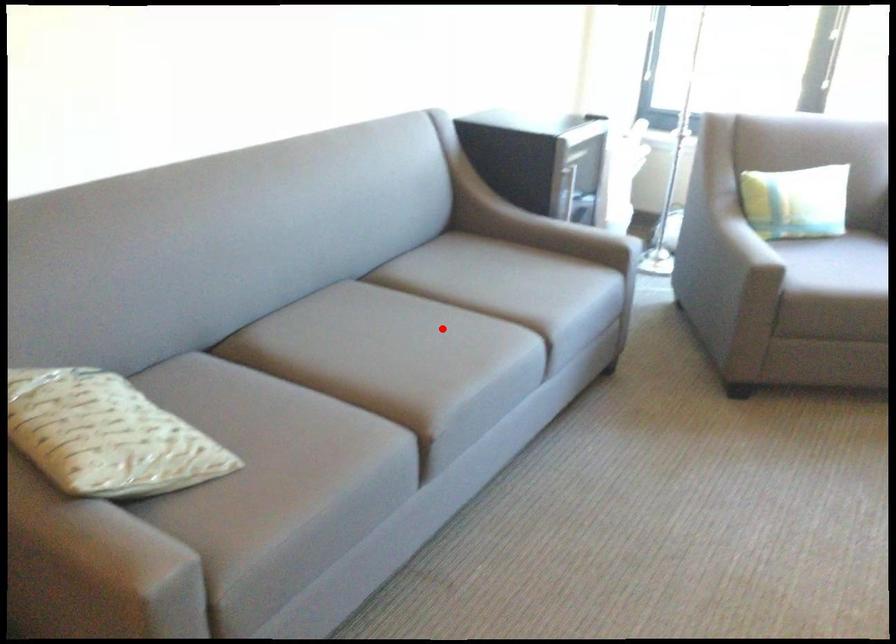
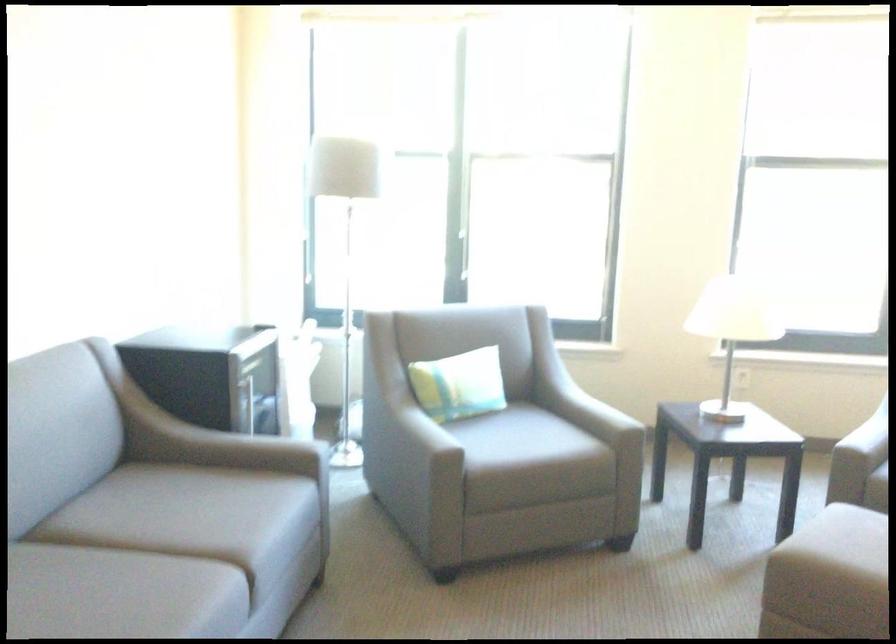
The point at the highlighted location is marked in the first image. Where is the corresponding point in the second image?

(119, 594)